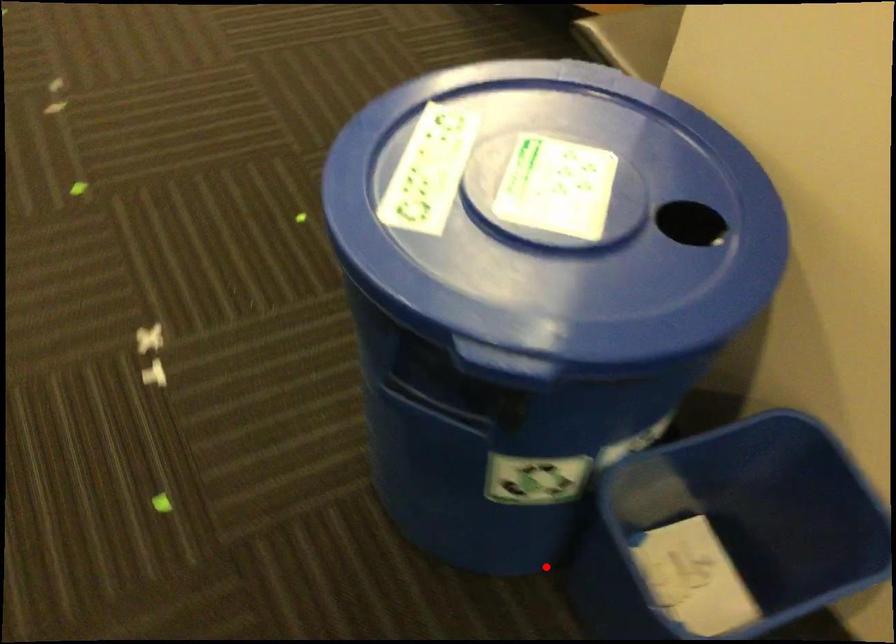
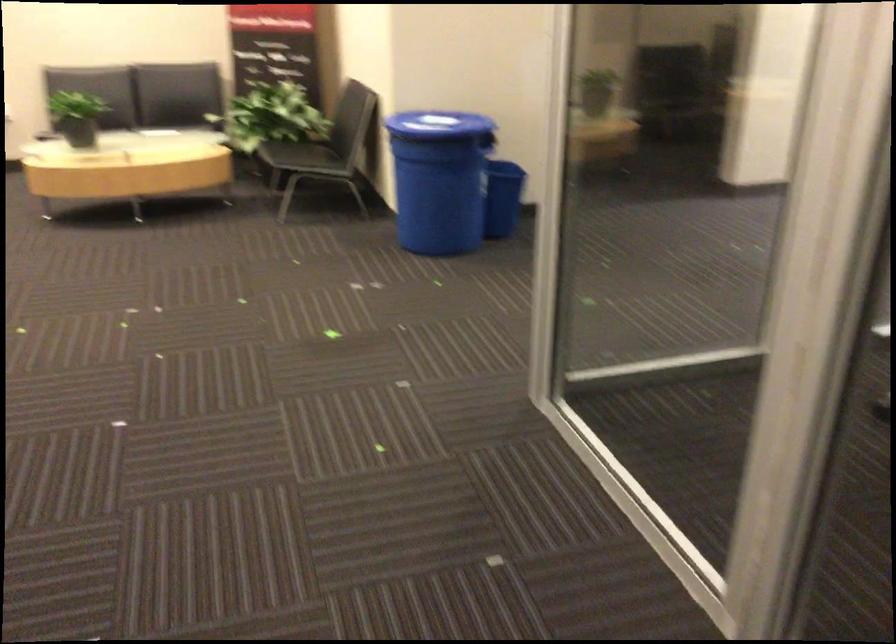
Question: I am providing you with two images of the same scene from different viewpoints. In image1, a red point is highlighted. Considering the same 3D point in image2, which of the following is correct?

Choices:
 (A) It is closer
 (B) It is farther

Answer: (B)